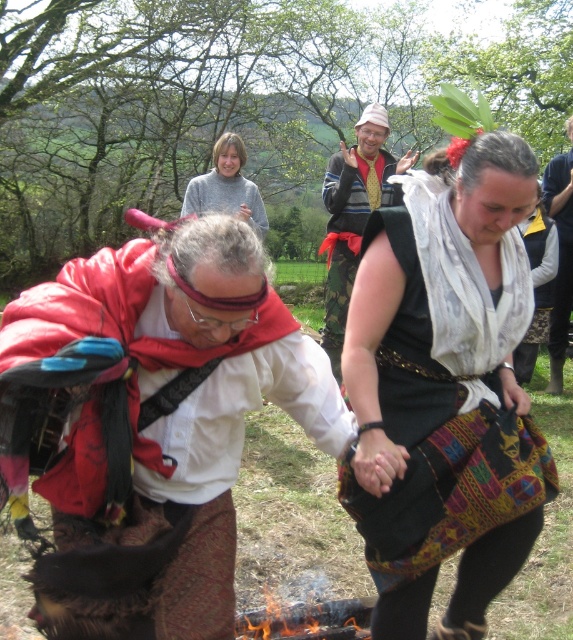
Can you confirm if black woven fabric bag at center is wider than striped sweater at center?

In fact, black woven fabric bag at center might be narrower than striped sweater at center.

Between black woven fabric bag at center and striped sweater at center, which one has less height?

black woven fabric bag at center is shorter.

Is point (466, 198) closer to camera compared to point (355, 240)?

Yes, point (466, 198) is closer to viewer.

Locate an element on the screen. The height and width of the screenshot is (640, 573). black woven fabric bag at center is located at coordinates 445,394.

Can you confirm if matte red cape at center is positioned below black woven fabric bag at center?

Yes, matte red cape at center is below black woven fabric bag at center.

Does matte red cape at center appear on the left side of black woven fabric bag at center?

Correct, you'll find matte red cape at center to the left of black woven fabric bag at center.

Between point (103, 385) and point (442, 173), which one is positioned in front?

Point (103, 385) is more forward.

I want to click on matte red cape at center, so click(148, 424).

Can you confirm if charcoal wood fire at lower center is smaller than velvet yellow vest at center?

Indeed, charcoal wood fire at lower center has a smaller size compared to velvet yellow vest at center.

Is charcoal wood fire at lower center closer to the viewer compared to velvet yellow vest at center?

Yes.

This screenshot has width=573, height=640. In order to click on charcoal wood fire at lower center in this screenshot , I will do `click(308, 620)`.